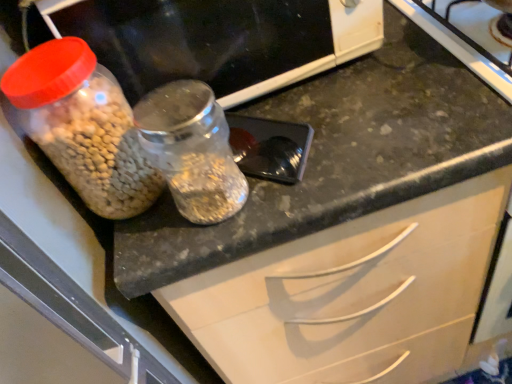
Question: Is translucent plastic jar at left closer to camera compared to transparent glass jar at center?

Choices:
 (A) yes
 (B) no

Answer: (B)

Question: Is translucent plastic jar at left bigger than transparent glass jar at center?

Choices:
 (A) yes
 (B) no

Answer: (A)

Question: Does translucent plastic jar at left touch transparent glass jar at center?

Choices:
 (A) no
 (B) yes

Answer: (B)

Question: Is translucent plastic jar at left not close to transparent glass jar at center?

Choices:
 (A) yes
 (B) no

Answer: (B)

Question: From a real-world perspective, is translucent plastic jar at left under transparent glass jar at center?

Choices:
 (A) yes
 (B) no

Answer: (B)

Question: From a real-world perspective, is transparent glass jar at center positioned above or below translucent plastic jar at left?

Choices:
 (A) above
 (B) below

Answer: (B)

Question: Is transparent glass jar at center wider or thinner than translucent plastic jar at left?

Choices:
 (A) thin
 (B) wide

Answer: (A)

Question: Choose the correct answer: Is transparent glass jar at center inside translucent plastic jar at left or outside it?

Choices:
 (A) outside
 (B) inside

Answer: (A)

Question: Considering the positions of transparent glass jar at center and translucent plastic jar at left in the image, is transparent glass jar at center bigger or smaller than translucent plastic jar at left?

Choices:
 (A) big
 (B) small

Answer: (B)

Question: From the image's perspective, is translucent plastic jar at left positioned above or below translucent plastic jar at left?

Choices:
 (A) above
 (B) below

Answer: (A)

Question: In terms of size, does translucent plastic jar at left appear bigger or smaller than translucent plastic jar at left?

Choices:
 (A) big
 (B) small

Answer: (A)

Question: Considering the positions of translucent plastic jar at left and translucent plastic jar at left in the image, is translucent plastic jar at left wider or thinner than translucent plastic jar at left?

Choices:
 (A) wide
 (B) thin

Answer: (A)

Question: In terms of height, does translucent plastic jar at left look taller or shorter compared to translucent plastic jar at left?

Choices:
 (A) tall
 (B) short

Answer: (A)

Question: Do you think transparent glass jar at center is within translucent plastic jar at left, or outside of it?

Choices:
 (A) outside
 (B) inside

Answer: (A)

Question: Would you say transparent glass jar at center is to the left or to the right of translucent plastic jar at left in the picture?

Choices:
 (A) right
 (B) left

Answer: (B)